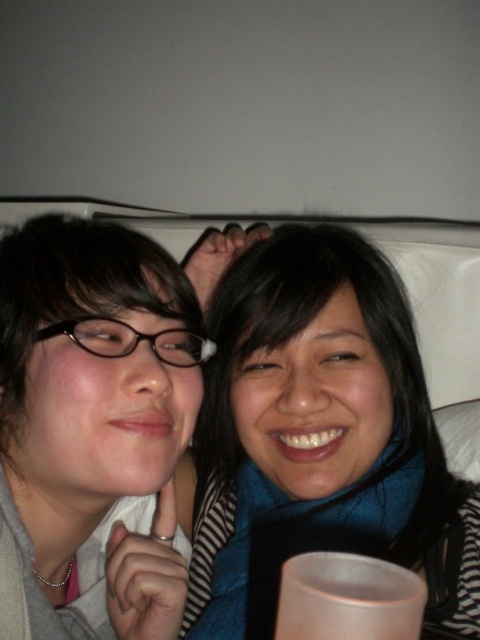
You are a photographer who needs to adjust the lighting to ensure both the blue fabric scarf at upper center and the white matte cup at lower center are clearly visible. Since the scene is dark, you decide to use a flash. However, the flash might reflect off one of the objects. Which object is more likely to cause glare when the flash is used?

The white matte cup at lower center is more likely to cause glare when the flash is used because it has a reflective surface compared to the blue fabric scarf at upper center.

You are a photographer who wants to ensure both the blue fabric scarf at upper center and the white matte cup at lower center are clearly visible in the photo. Given their sizes, which object might require more careful framing to avoid being too small in the image?

The white matte cup at lower center requires more careful framing because it is smaller in size compared to the blue fabric scarf at upper center, so it might appear too small if not properly positioned.